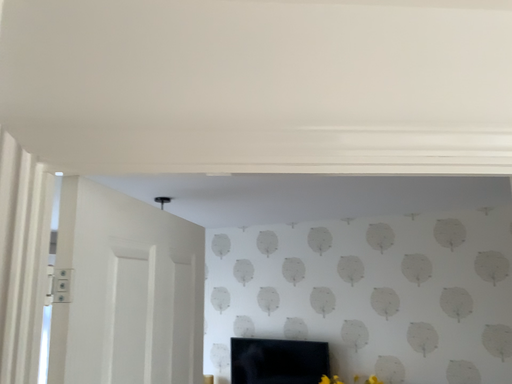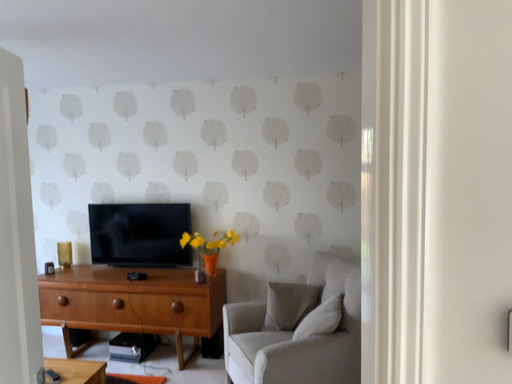
Question: Which way did the camera rotate in the video?

Choices:
 (A) rotated downward
 (B) rotated upward

Answer: (A)